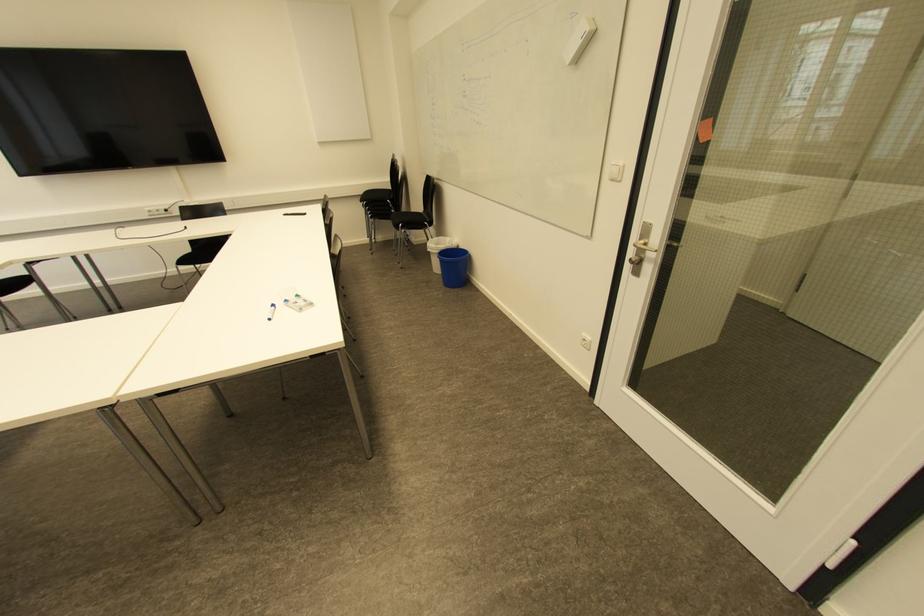
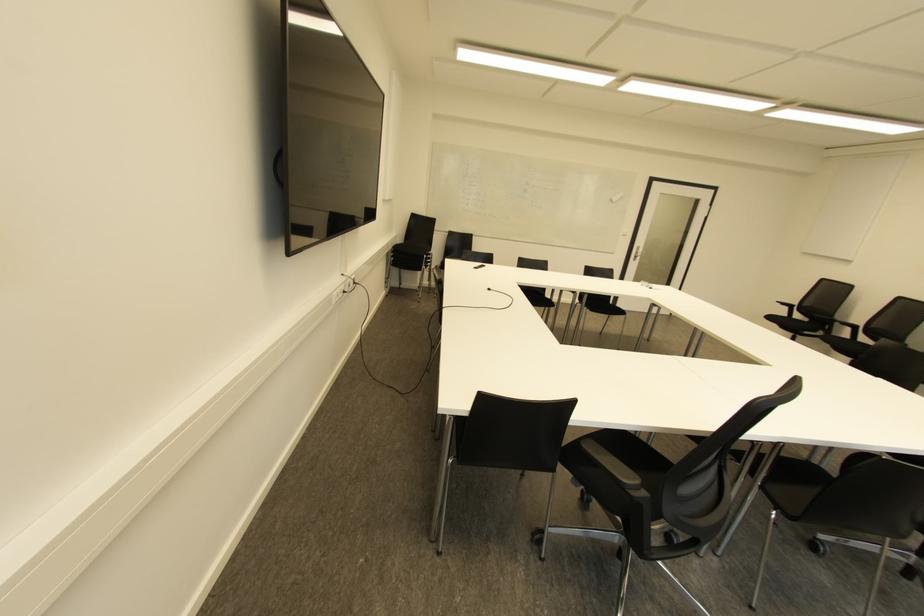
Find the pixel in the second image that matches (x=638, y=262) in the first image.

(636, 257)